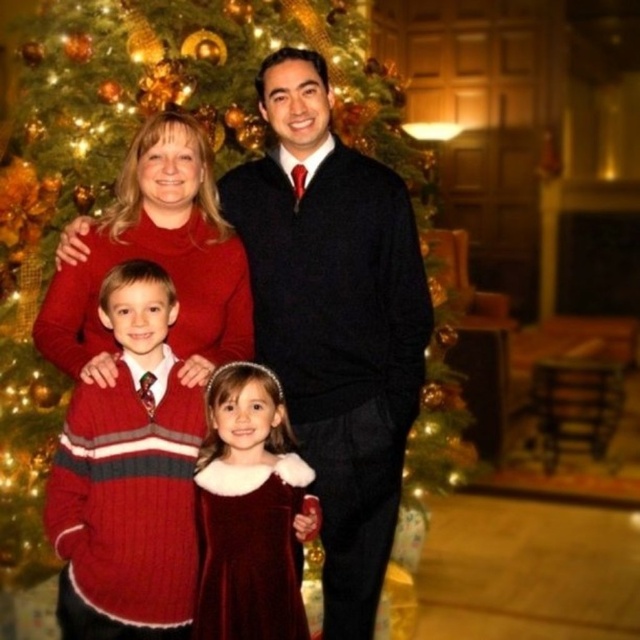
Can you confirm if green textured christmas tree at center is thinner than matte black sweater at center?

Incorrect, green textured christmas tree at center's width is not less than matte black sweater at center's.

Is point (252, 144) farther from viewer compared to point (264, 332)?

Yes.

Does point (17, 336) come behind point (378, 410)?

Yes, it is.

Locate an element on the screen. This screenshot has width=640, height=640. green textured christmas tree at center is located at coordinates (118, 164).

Is green textured christmas tree at center above cable-knit sweater at left?

Yes.

Measure the distance from green textured christmas tree at center to cable-knit sweater at left.

green textured christmas tree at center and cable-knit sweater at left are 28.88 inches apart from each other.

Where is `green textured christmas tree at center`? This screenshot has height=640, width=640. green textured christmas tree at center is located at coordinates click(x=118, y=164).

Find the location of a particular element. green textured christmas tree at center is located at coordinates (118, 164).

Which is below, green textured christmas tree at center or velvet dress at center?

Positioned lower is velvet dress at center.

This screenshot has height=640, width=640. What do you see at coordinates (118, 164) in the screenshot?
I see `green textured christmas tree at center` at bounding box center [118, 164].

You are a GUI agent. You are given a task and a screenshot of the screen. Output one action in this format:
    pyautogui.click(x=<x>, y=<y>)
    Task: Click on the green textured christmas tree at center
    This screenshot has width=640, height=640.
    Given the screenshot: What is the action you would take?
    pyautogui.click(x=118, y=164)